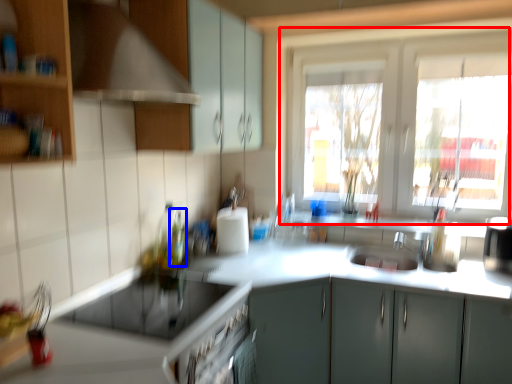
Question: Which point is closer to the camera, window (highlighted by a red box) or bottle (highlighted by a blue box)?

Choices:
 (A) window
 (B) bottle

Answer: (B)